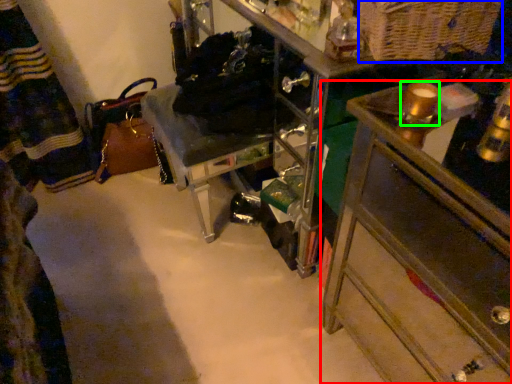
Question: Which object is positioned farthest from chest of drawers (highlighted by a red box)? Select from basket (highlighted by a blue box) and beverage (highlighted by a green box).

Choices:
 (A) basket
 (B) beverage

Answer: (A)